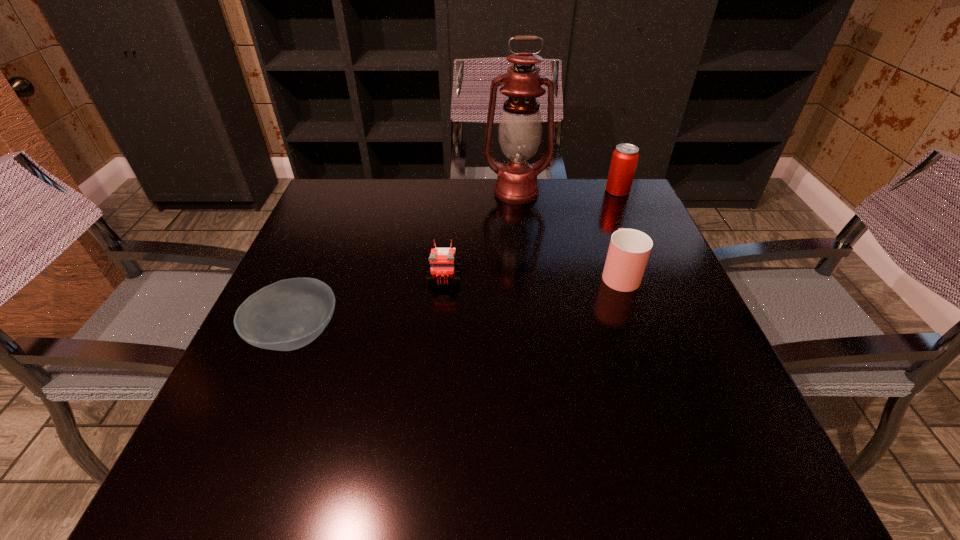
Find the location of a particular element. The width and height of the screenshot is (960, 540). cup located in the right edge section of the desktop is located at coordinates (629, 249).

This screenshot has width=960, height=540. I want to click on object situated at the far right corner, so pos(625,157).

Locate an element on the screen. free location at the far edge of the desktop is located at coordinates (556, 191).

Locate an element on the screen. The height and width of the screenshot is (540, 960). vacant space at the near edge of the desktop is located at coordinates (498, 444).

The height and width of the screenshot is (540, 960). Identify the location of vacant area at the left edge. 322,354.

Locate an element on the screen. free space at the right edge is located at coordinates (611, 235).

Where is `vacant space at the far left corner`? vacant space at the far left corner is located at coordinates tap(326, 191).

Where is `free space at the near right corner of the desktop`? free space at the near right corner of the desktop is located at coordinates (784, 492).

I want to click on vacant area between the second tallest object and the third object from left to right, so click(567, 192).

Where is `free spot between the leftmost object and the third tallest object`? The height and width of the screenshot is (540, 960). free spot between the leftmost object and the third tallest object is located at coordinates (458, 304).